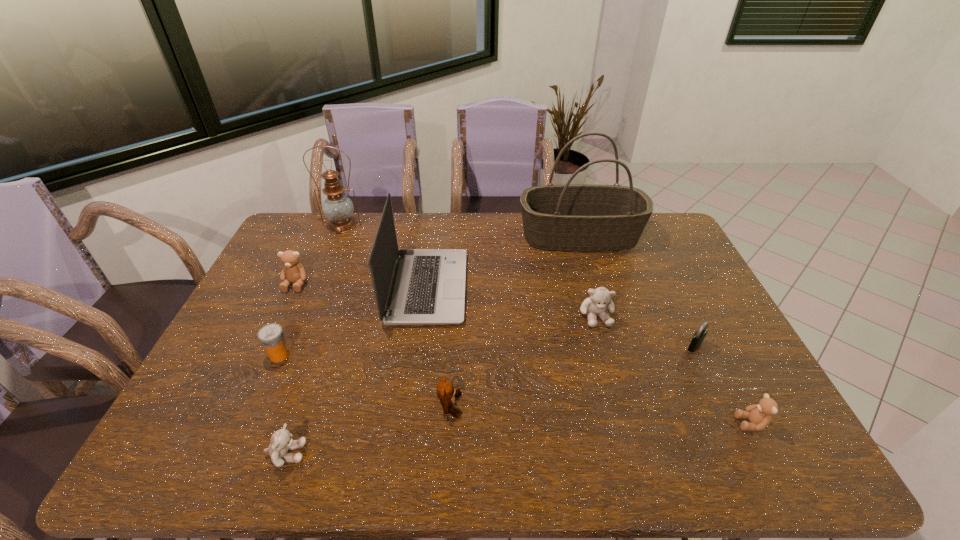
In order to click on the rightmost teddy bear in this screenshot , I will do `click(759, 415)`.

Identify the location of the nearer gray teddy bear. (281, 442).

At what (x,y) coordinates should I click in order to perform the action: click on the second teddy bear from left to right. Please return your answer as a coordinate pair (x, y). Looking at the image, I should click on (281, 442).

What are the coordinates of `vacant space located 0.290m on the left of the basket` in the screenshot? It's located at (440, 236).

Where is `free point located 0.220m on the right of the oil lamp`? free point located 0.220m on the right of the oil lamp is located at coordinates (420, 226).

The height and width of the screenshot is (540, 960). I want to click on vacant area situated 0.180m on the screen of the laptop computer, so click(521, 287).

At what (x,y) coordinates should I click in order to perform the action: click on free region located on the face of the farthest brown teddy bear. Please return your answer as a coordinate pair (x, y). The width and height of the screenshot is (960, 540). Looking at the image, I should click on (280, 318).

At what (x,y) coordinates should I click in order to perform the action: click on vacant region located on the face of the second farthest teddy bear. Please return your answer as a coordinate pair (x, y). Image resolution: width=960 pixels, height=540 pixels. Looking at the image, I should click on (619, 399).

Identify the location of vacant space located 0.090m on the front of the black padlock. This screenshot has width=960, height=540. (710, 380).

Locate an element on the screen. The height and width of the screenshot is (540, 960). vacant space located on the front-facing side of the second brown teddy bear from right to left is located at coordinates (618, 406).